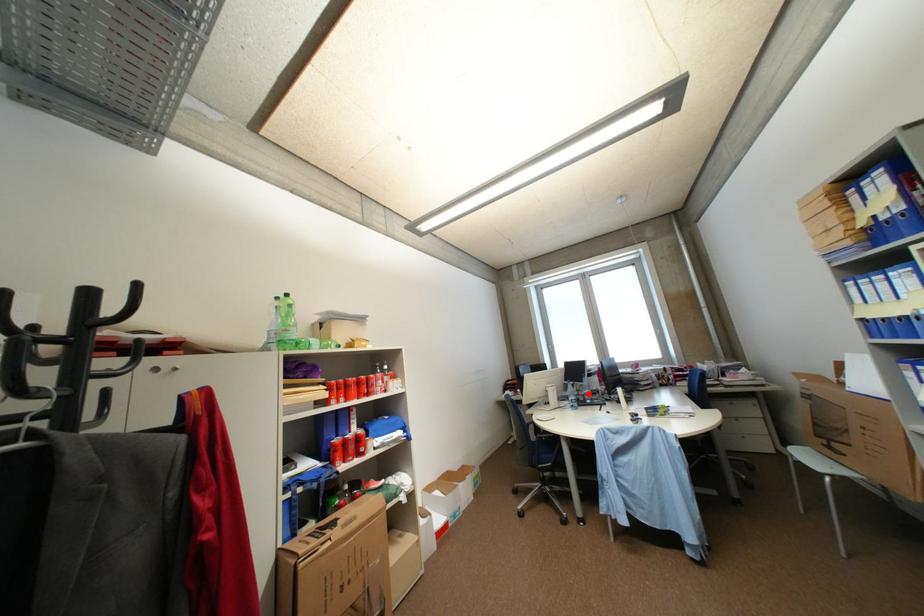
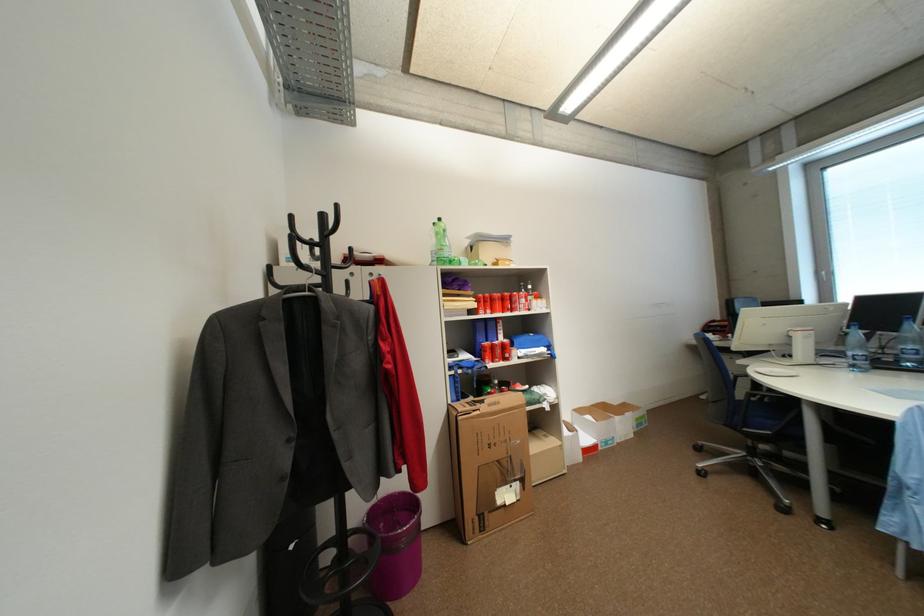
The point at the highlighted location is marked in the first image. Where is the corresponding point in the second image?

(897, 352)